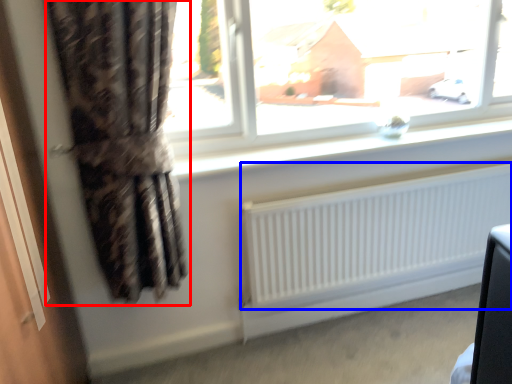
Question: Which object is closer to the camera taking this photo, curtain (highlighted by a red box) or radiator (highlighted by a blue box)?

Choices:
 (A) curtain
 (B) radiator

Answer: (A)